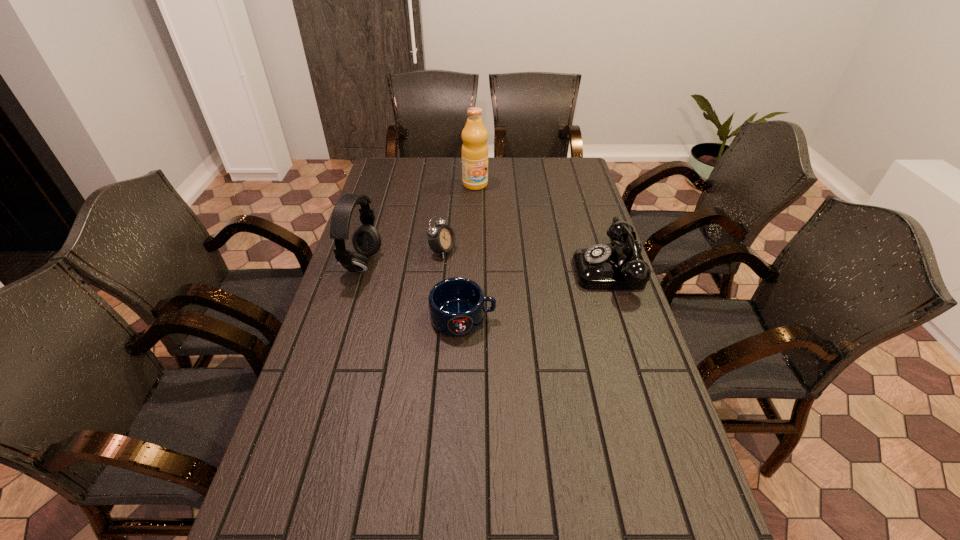
This screenshot has height=540, width=960. I want to click on object that is the fourth closest one to the leftmost object, so click(x=601, y=267).

At what (x,y) coordinates should I click in order to perform the action: click on vacant region that satisfies the following two spatial constraints: 1. on the back side of the farthest object; 2. on the right side of the alarm clock. Please return your answer as a coordinate pair (x, y). Looking at the image, I should click on (449, 185).

I want to click on free point that satisfies the following two spatial constraints: 1. on the front side of the leftmost object; 2. on the dial of the rightmost object, so click(x=361, y=269).

Identify the location of free space in the image that satisfies the following two spatial constraints: 1. on the front side of the shortest object; 2. with the handle on the side of the alarm clock. The height and width of the screenshot is (540, 960). (436, 318).

Identify the location of vacant area in the image that satisfies the following two spatial constraints: 1. on the back side of the leftmost object; 2. on the left side of the farthest object. This screenshot has height=540, width=960. (387, 185).